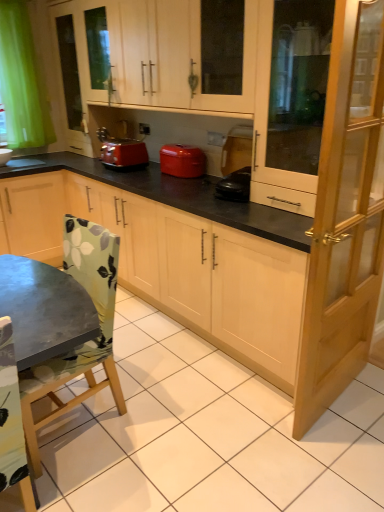
From the picture: In order to face matte red toaster at center, should I rotate leftwards or rightwards?

To face it directly, rotate left by 1.358 degrees.

Where is `matte red toaster at center`? This screenshot has height=512, width=384. matte red toaster at center is located at coordinates (182, 161).

Describe the element at coordinates (345, 215) in the screenshot. This screenshot has width=384, height=512. I see `light brown wooden screen door at right, positioned as the first screen door in bottom-to-top order` at that location.

The width and height of the screenshot is (384, 512). Describe the element at coordinates (290, 98) in the screenshot. I see `transparent glass cabinet at right, the 1th screen door when ordered from top to bottom` at that location.

The image size is (384, 512). I want to click on white glossy sink at lower left, so click(x=5, y=156).

The height and width of the screenshot is (512, 384). What do you see at coordinates (175, 265) in the screenshot?
I see `matte wood cabinet at center, which appears as the second cabinetry when viewed from the top` at bounding box center [175, 265].

At what (x,y) coordinates should I click in order to perform the action: click on black plastic coffee maker at center. Please return your answer as a coordinate pair (x, y). The width and height of the screenshot is (384, 512). Looking at the image, I should click on (237, 149).

Is matte red toaster at center shorter than white glossy sink at lower left?

In fact, matte red toaster at center may be taller than white glossy sink at lower left.

At what (x,y) coordinates should I click in order to perform the action: click on home appliance that appears on the right of white glossy sink at lower left. Please return your answer as a coordinate pair (x, y). This screenshot has height=512, width=384. Looking at the image, I should click on (182, 161).

Considering the relative sizes of matte red toaster at center and white glossy sink at lower left in the image provided, is matte red toaster at center wider than white glossy sink at lower left?

Indeed, matte red toaster at center has a greater width compared to white glossy sink at lower left.

Does point (169, 164) come farther from viewer compared to point (0, 151)?

That is False.

From the picture: Does light brown wooden screen door at right, positioned as the first screen door in bottom-to-top order, have a lesser width compared to matte wood cabinet at upper center, the first cabinetry from the top?

Yes, light brown wooden screen door at right, positioned as the first screen door in bottom-to-top order, is thinner than matte wood cabinet at upper center, the first cabinetry from the top.

From a real-world perspective, which object rests below the other?

In real-world perspective, light brown wooden screen door at right, which is counted as the second screen door, starting from the top, is lower.

What's the angular difference between light brown wooden screen door at right, which is counted as the second screen door, starting from the top, and matte wood cabinet at upper center, the first cabinetry from the top,'s facing directions?

95.6 degrees.

Considering the relative sizes of light brown wooden screen door at right, which is counted as the second screen door, starting from the top, and matte wood cabinet at upper center, the first cabinetry from the top, in the image provided, is light brown wooden screen door at right, which is counted as the second screen door, starting from the top, smaller than matte wood cabinet at upper center, the first cabinetry from the top,?

Yes.

From the picture: Considering the relative sizes of matte red toaster at center and light brown wooden screen door at right, which is counted as the second screen door, starting from the top, in the image provided, is matte red toaster at center smaller than light brown wooden screen door at right, which is counted as the second screen door, starting from the top,?

Yes, matte red toaster at center is smaller than light brown wooden screen door at right, which is counted as the second screen door, starting from the top.

Is matte red toaster at center far away from light brown wooden screen door at right, which is counted as the second screen door, starting from the top?

Yes, matte red toaster at center is far from light brown wooden screen door at right, which is counted as the second screen door, starting from the top.

From the image's perspective, relative to light brown wooden screen door at right, positioned as the first screen door in bottom-to-top order, is matte red toaster at center above or below?

From the image's perspective, matte red toaster at center appears above light brown wooden screen door at right, positioned as the first screen door in bottom-to-top order.

Could you tell me if matte red toaster at center is turned towards light brown wooden screen door at right, which is counted as the second screen door, starting from the top?

No, matte red toaster at center is not aimed at light brown wooden screen door at right, which is counted as the second screen door, starting from the top.

Do you think green fabric chair at lower left is within transparent glass cabinet at right, the 1th screen door when ordered from top to bottom, or outside of it?

green fabric chair at lower left is outside transparent glass cabinet at right, the 1th screen door when ordered from top to bottom.

Is green fabric chair at lower left oriented away from transparent glass cabinet at right, the 1th screen door when ordered from top to bottom?

Yes, green fabric chair at lower left is facing away from transparent glass cabinet at right, the 1th screen door when ordered from top to bottom.

Find the location of a particular element. chair below the transparent glass cabinet at right, the 1th screen door when ordered from top to bottom (from the image's perspective) is located at coordinates (84, 343).

Is matte red toaster at center next to light brown wooden screen door at right, which is counted as the second screen door, starting from the top?

matte red toaster at center and light brown wooden screen door at right, which is counted as the second screen door, starting from the top, are not in contact.

Considering the sizes of matte red toaster at center and light brown wooden screen door at right, positioned as the first screen door in bottom-to-top order, in the image, is matte red toaster at center wider or thinner than light brown wooden screen door at right, positioned as the first screen door in bottom-to-top order,?

matte red toaster at center is wider than light brown wooden screen door at right, positioned as the first screen door in bottom-to-top order.

Is matte red toaster at center taller or shorter than light brown wooden screen door at right, positioned as the first screen door in bottom-to-top order?

Clearly, matte red toaster at center is shorter compared to light brown wooden screen door at right, positioned as the first screen door in bottom-to-top order.

From the image's perspective, which one is positioned lower, matte red toaster at center or light brown wooden screen door at right, which is counted as the second screen door, starting from the top?

light brown wooden screen door at right, which is counted as the second screen door, starting from the top, is shown below in the image.

Is light brown wooden screen door at right, positioned as the first screen door in bottom-to-top order, facing away from transparent glass cabinet at right, which is counted as the 2th screen door, starting from the bottom?

Yes, transparent glass cabinet at right, which is counted as the 2th screen door, starting from the bottom, is at the back of light brown wooden screen door at right, positioned as the first screen door in bottom-to-top order.

How different are the orientations of light brown wooden screen door at right, positioned as the first screen door in bottom-to-top order, and transparent glass cabinet at right, the 1th screen door when ordered from top to bottom, in degrees?

They differ by 94.8 degrees in their facing directions.

In the scene shown: In terms of width, does light brown wooden screen door at right, positioned as the first screen door in bottom-to-top order, look wider or thinner when compared to transparent glass cabinet at right, which is counted as the 2th screen door, starting from the bottom?

light brown wooden screen door at right, positioned as the first screen door in bottom-to-top order, is thinner than transparent glass cabinet at right, which is counted as the 2th screen door, starting from the bottom.

Is the position of light brown wooden screen door at right, which is counted as the second screen door, starting from the top, more distant than that of transparent glass cabinet at right, which is counted as the 2th screen door, starting from the bottom?

That is False.

Based on the photo, can you tell me how much light brown wooden screen door at right, which is counted as the second screen door, starting from the top, and green fabric chair at lower left differ in facing direction?

88.3 degrees.

Can you confirm if light brown wooden screen door at right, positioned as the first screen door in bottom-to-top order, is bigger than green fabric chair at lower left?

No.

In the scene shown: Is light brown wooden screen door at right, positioned as the first screen door in bottom-to-top order, with green fabric chair at lower left?

No, light brown wooden screen door at right, positioned as the first screen door in bottom-to-top order, is not beside green fabric chair at lower left.

Is light brown wooden screen door at right, positioned as the first screen door in bottom-to-top order, oriented away from green fabric chair at lower left?

No, light brown wooden screen door at right, positioned as the first screen door in bottom-to-top order,'s orientation is not away from green fabric chair at lower left.

The image size is (384, 512). In the image, there is a white glossy sink at lower left. Identify the location of home appliance below it (from the image's perspective). (182, 161).

Locate an element on the screen. This screenshot has height=512, width=384. the 1st cabinetry counting from the left of the light brown wooden screen door at right, which is counted as the second screen door, starting from the top is located at coordinates (166, 52).

From the image, which object appears to be farther from transparent glass cabinet at right, which is counted as the 2th screen door, starting from the bottom, white glossy sink at lower left or black plastic coffee maker at center?

white glossy sink at lower left is positioned further to the anchor transparent glass cabinet at right, which is counted as the 2th screen door, starting from the bottom.

Looking at the image, which one is located closer to black plastic coffee maker at center, matte red toaster at center or transparent glass cabinet at right, which is counted as the 2th screen door, starting from the bottom?

Based on the image, transparent glass cabinet at right, which is counted as the 2th screen door, starting from the bottom, appears to be nearer to black plastic coffee maker at center.

Looking at the image, which one is located closer to light brown wooden screen door at right, positioned as the first screen door in bottom-to-top order, matte red toaster at center or white glossy sink at lower left?

matte red toaster at center is closer to light brown wooden screen door at right, positioned as the first screen door in bottom-to-top order.

Based on their spatial positions, is black plastic coffee maker at center or transparent glass cabinet at right, the 1th screen door when ordered from top to bottom, further from green fabric chair at lower left?

black plastic coffee maker at center.

Looking at the image, which one is located further to matte wood cabinet at upper center, which ranks as the 2th cabinetry in bottom-to-top order, transparent glass cabinet at right, the 1th screen door when ordered from top to bottom, or matte wood cabinet at center, which appears as the second cabinetry when viewed from the top?

matte wood cabinet at center, which appears as the second cabinetry when viewed from the top.

When comparing their distances from matte red toaster at center, does green fabric chair at lower left or light brown wooden screen door at right, which is counted as the second screen door, starting from the top, seem further?

The object further to matte red toaster at center is light brown wooden screen door at right, which is counted as the second screen door, starting from the top.

Consider the image. Looking at the image, which one is located closer to transparent glass cabinet at right, which is counted as the 2th screen door, starting from the bottom, matte red toaster at center or matte wood cabinet at upper center, the first cabinetry from the top?

matte wood cabinet at upper center, the first cabinetry from the top, lies closer to transparent glass cabinet at right, which is counted as the 2th screen door, starting from the bottom, than the other object.

Considering their positions, is matte wood cabinet at center, which appears as the second cabinetry when viewed from the top, positioned further to transparent glass cabinet at right, the 1th screen door when ordered from top to bottom, than black plastic coffee maker at center?

matte wood cabinet at center, which appears as the second cabinetry when viewed from the top, is further to transparent glass cabinet at right, the 1th screen door when ordered from top to bottom.

Locate an element on the screen. This screenshot has height=512, width=384. chair between white glossy sink at lower left and transparent glass cabinet at right, the 1th screen door when ordered from top to bottom, from left to right is located at coordinates (84, 343).

Find the location of `chair between light brown wooden screen door at right, positioned as the first screen door in bottom-to-top order, and black plastic coffee maker at center from front to back`. chair between light brown wooden screen door at right, positioned as the first screen door in bottom-to-top order, and black plastic coffee maker at center from front to back is located at coordinates (84, 343).

Find the location of a particular element. This screenshot has width=384, height=512. appliance positioned between transparent glass cabinet at right, the 1th screen door when ordered from top to bottom, and matte red toaster at center from near to far is located at coordinates 237,149.

Image resolution: width=384 pixels, height=512 pixels. I want to click on appliance between light brown wooden screen door at right, positioned as the first screen door in bottom-to-top order, and matte red toaster at center from front to back, so click(237, 149).